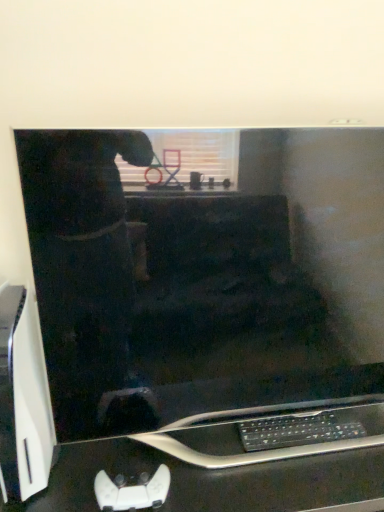
What are the coordinates of `free space above black glossy computer desk at lower center (from a real-world perspective)` in the screenshot? It's located at (244, 455).